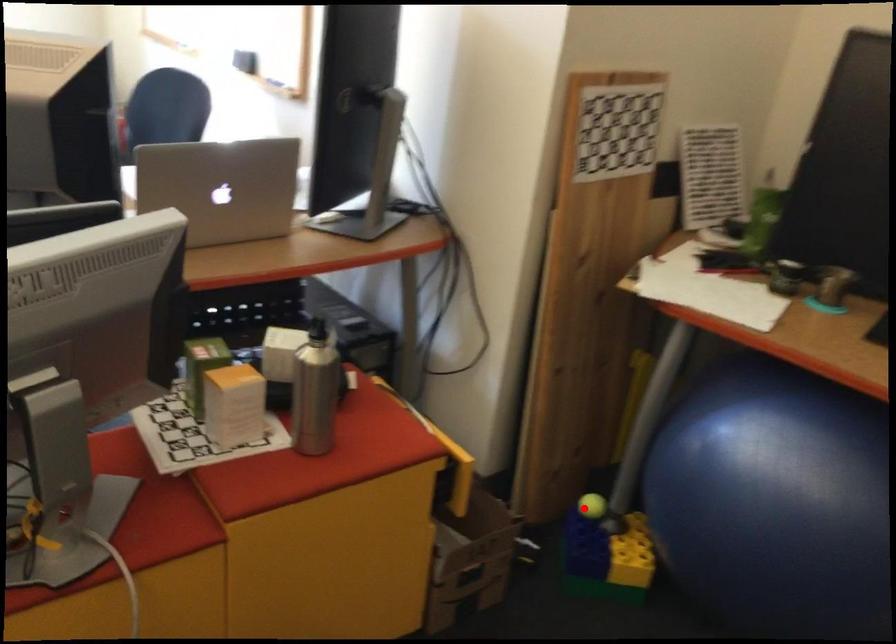
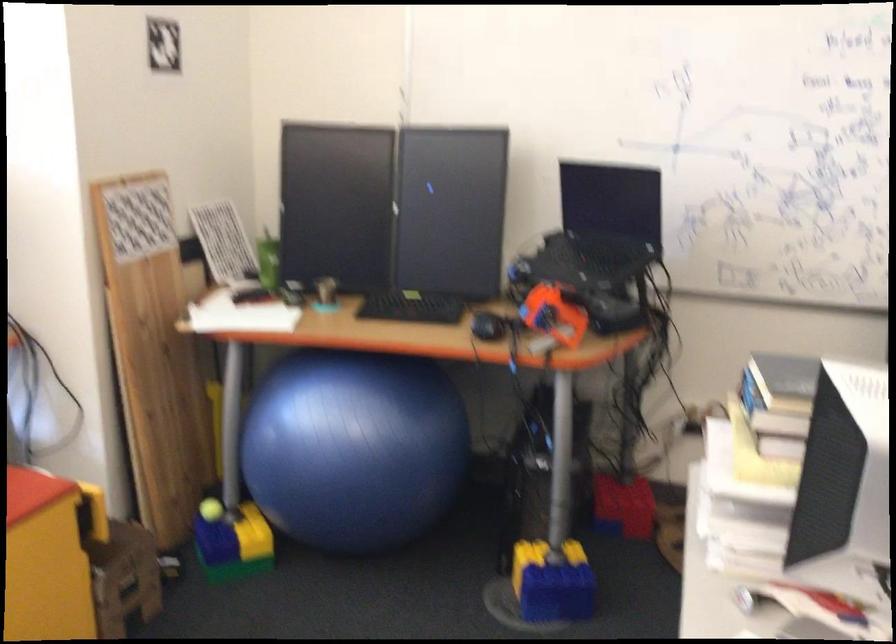
Question: I am providing you with two images of the same scene from different viewpoints. Image1 has a red point marked. In image2, the corresponding 3D location appears at what relative position? Reply with the corresponding letter.

Choices:
 (A) Closer
 (B) Farther

Answer: (B)